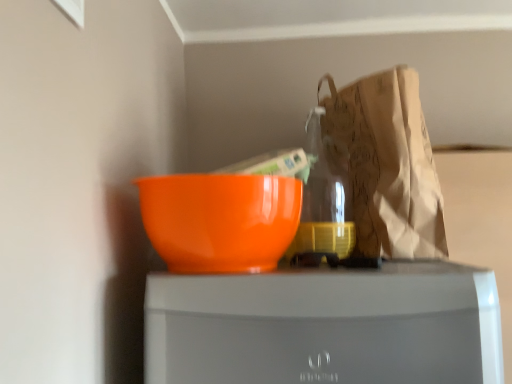
Question: Should I look upward or downward to see brown paper bag at upper right?

Choices:
 (A) up
 (B) down

Answer: (A)